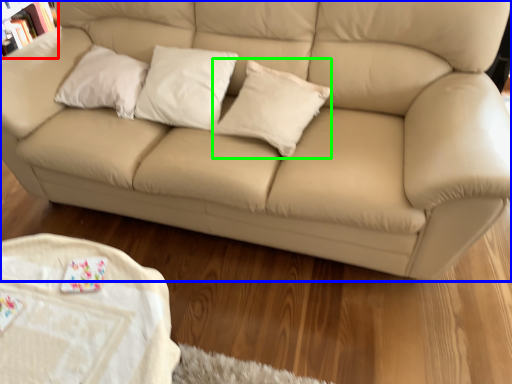
Question: Estimate the real-world distances between objects in this image. Which object is closer to bookcase (highlighted by a red box), studio couch (highlighted by a blue box) or pillow (highlighted by a green box)?

Choices:
 (A) studio couch
 (B) pillow

Answer: (A)